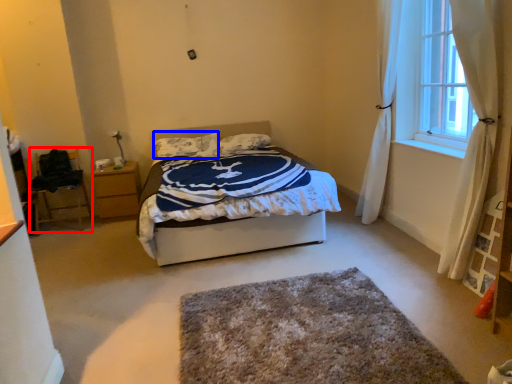
Question: Which object is closer to the camera taking this photo, furniture (highlighted by a red box) or pillow (highlighted by a blue box)?

Choices:
 (A) furniture
 (B) pillow

Answer: (A)